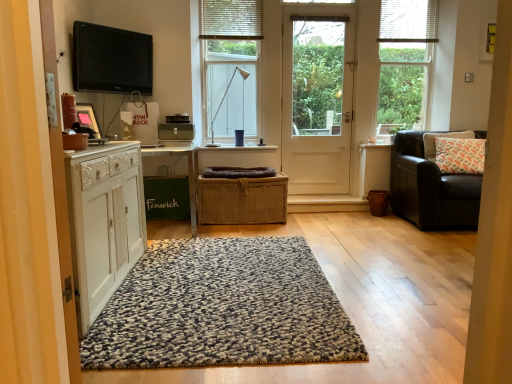
I want to click on leather couch at right, so click(430, 188).

Describe the element at coordinates (441, 136) in the screenshot. The image size is (512, 384). I see `white fabric pillow at right` at that location.

Image resolution: width=512 pixels, height=384 pixels. What do you see at coordinates (317, 97) in the screenshot?
I see `white wooden door at center` at bounding box center [317, 97].

Find the location of a particular element. The image size is (512, 384). white textured blind at upper center, the 1th blind viewed from the left is located at coordinates (231, 19).

Which object is further away from the camera, green fabric bag at left or white textured window at center, which is the 2th window from right to left?

white textured window at center, which is the 2th window from right to left, is more distant.

From the picture: Which of these two, green fabric bag at left or white textured window at center, which is the 2th window from right to left, is bigger?

With larger size is green fabric bag at left.

Would you consider green fabric bag at left to be distant from white textured window at center, which is the 2th window from right to left?

That's not correct — green fabric bag at left is a little close to white textured window at center, which is the 2th window from right to left.

Is transparent glass window at upper right, positioned as the 1th window in right-to-left order, facing towards leather couch at right?

Yes, transparent glass window at upper right, positioned as the 1th window in right-to-left order, is turned towards leather couch at right.

Does transparent glass window at upper right, positioned as the 1th window in right-to-left order, appear on the left side of leather couch at right?

Indeed, transparent glass window at upper right, positioned as the 1th window in right-to-left order, is positioned on the left side of leather couch at right.

Is point (385, 73) positioned after point (394, 188)?

Yes, point (385, 73) is behind point (394, 188).

Would you say transparent glass window at upper right, positioned as the 1th window in right-to-left order, is outside leather couch at right?

Indeed, transparent glass window at upper right, positioned as the 1th window in right-to-left order, is completely outside leather couch at right.

Which is more to the left, transparent glass window at upper right, positioned as the 1th window in right-to-left order, or white fabric pillow at right?

From the viewer's perspective, transparent glass window at upper right, positioned as the 1th window in right-to-left order, appears more on the left side.

Does transparent glass window at upper right, positioned as the 1th window in right-to-left order, lie behind white fabric pillow at right?

Yes, it is behind white fabric pillow at right.

From the image's perspective, starting from the white fabric pillow at right, which window is the 2nd one above? Please provide its 2D coordinates.

[(405, 62)]

Is transparent glass window at upper right, positioned as the 1th window in right-to-left order, positioned far away from white fabric pillow at right?

They are positioned close to each other.

Measure the distance between textured wool rug at center and white painted wood cabinet at left.

textured wool rug at center is 20.53 inches from white painted wood cabinet at left.

Is textured wool rug at center facing towards white painted wood cabinet at left?

No.

Does textured wool rug at center appear on the right side of white painted wood cabinet at left?

Yes.

Considering the relative sizes of braided brown basket at center and white painted wood cabinet at left in the image provided, is braided brown basket at center shorter than white painted wood cabinet at left?

Yes, braided brown basket at center is shorter than white painted wood cabinet at left.

This screenshot has height=384, width=512. In the image, there is a braided brown basket at center. What are the coordinates of `cabinetry below it (from the image's perspective)` in the screenshot? It's located at (104, 221).

Can you tell me how much braided brown basket at center and white painted wood cabinet at left differ in facing direction?

braided brown basket at center and white painted wood cabinet at left are facing 88.5 degrees away from each other.

Is braided brown basket at center next to white painted wood cabinet at left and touching it?

No, braided brown basket at center is not touching white painted wood cabinet at left.

From the image's perspective, is textured wool rug at center positioned above or below white fabric pillow at right?

Based on their image positions, textured wool rug at center is located beneath white fabric pillow at right.

Based on their positions, is textured wool rug at center located to the left or right of white fabric pillow at right?

In the image, textured wool rug at center appears on the left side of white fabric pillow at right.

Is point (292, 262) positioned in front of point (430, 138)?

That is True.

From a real-world perspective, does textured wool rug at center stand above white fabric pillow at right?

No, from a real-world perspective, textured wool rug at center is not on top of white fabric pillow at right.

Which of these two, white painted wood cabinet at left or white fabric pillow at right, is bigger?

With larger size is white painted wood cabinet at left.

What are the coordinates of `cabinetry on the left of the white fabric pillow at right` in the screenshot? It's located at (104, 221).

Which is closer, (96, 207) or (434, 139)?

The point (96, 207) is more forward.

I want to click on the 1st window above the green fabric bag at left (from the image's perspective), so click(x=230, y=66).

The width and height of the screenshot is (512, 384). In the image, there is a transparent glass window at upper right, positioned as the 1th window in right-to-left order. Find the location of `chair below it (from the image's perspective)`. chair below it (from the image's perspective) is located at coordinates point(430,188).

From the image, which object appears to be nearer to white textured blind at upper center, the 1th blind viewed from the left, white fabric pillow at right or transparent glass window at upper right, positioned as the 1th window in right-to-left order?

transparent glass window at upper right, positioned as the 1th window in right-to-left order, is positioned closer to the anchor white textured blind at upper center, the 1th blind viewed from the left.

Based on their spatial positions, is transparent glass window at upper right, which is the 2th window from left to right, or white textured window at center, arranged as the first window when viewed from the left, further from black glossy tv at upper left?

Based on the image, transparent glass window at upper right, which is the 2th window from left to right, appears to be further to black glossy tv at upper left.

Based on their spatial positions, is black glossy tv at upper left or transparent glass window at upper right, which is the 2th window from left to right, further from leather couch at right?

black glossy tv at upper left lies further to leather couch at right than the other object.

In the scene shown: Based on their spatial positions, is leather couch at right or textured wool rug at center further from white wooden door at center?

Based on the image, textured wool rug at center appears to be further to white wooden door at center.

In the scene shown: Estimate the real-world distances between objects in this image. Which object is further from white fabric blinds at upper right, the 2th blind when ordered from left to right, white textured window at center, arranged as the first window when viewed from the left, or transparent glass window at upper right, which is the 2th window from left to right?

Based on the image, white textured window at center, arranged as the first window when viewed from the left, appears to be further to white fabric blinds at upper right, the 2th blind when ordered from left to right.

From the image, which object appears to be farther from white painted wood cabinet at left, white wooden door at center or white textured blind at upper center, which is counted as the 2th blind, starting from the right?

white wooden door at center.

From the image, which object appears to be nearer to white fabric pillow at right, black glossy tv at upper left or green fabric bag at left?

The object closer to white fabric pillow at right is green fabric bag at left.

Looking at this image, based on their spatial positions, is white textured blind at upper center, which is counted as the 2th blind, starting from the right, or leather couch at right further from transparent glass window at upper right, which is the 2th window from left to right?

The object further to transparent glass window at upper right, which is the 2th window from left to right, is white textured blind at upper center, which is counted as the 2th blind, starting from the right.

You are a GUI agent. You are given a task and a screenshot of the screen. Output one action in this format:
    pyautogui.click(x=<x>, y=<y>)
    Task: Click on the door between textured wool rug at center and white fabric blinds at upper right, the 2th blind when ordered from left to right, in the front-back direction
    The width and height of the screenshot is (512, 384).
    Given the screenshot: What is the action you would take?
    pyautogui.click(x=317, y=97)

Where is `doormat between black glossy tv at upper left and transparent glass window at upper right, which is the 2th window from left to right, in the horizontal direction`? This screenshot has height=384, width=512. doormat between black glossy tv at upper left and transparent glass window at upper right, which is the 2th window from left to right, in the horizontal direction is located at coordinates (222, 309).

This screenshot has height=384, width=512. In order to click on blind between green fabric bag at left and white fabric blinds at upper right, the first blind viewed from the right in this screenshot , I will do `click(231, 19)`.

At what (x,y) coordinates should I click in order to perform the action: click on pillow between white wooden door at center and leather couch at right from left to right. Please return your answer as a coordinate pair (x, y). The width and height of the screenshot is (512, 384). Looking at the image, I should click on (441, 136).